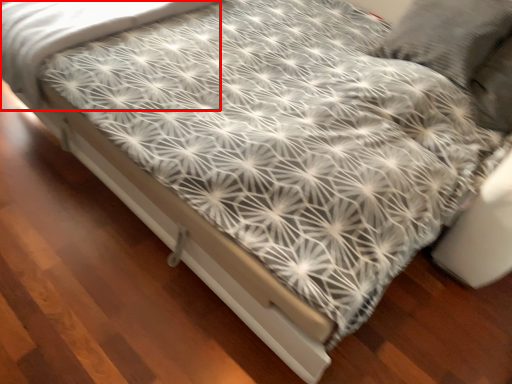
Question: From the image's perspective, where is sheet (annotated by the red box) located in relation to bed frame in the image?

Choices:
 (A) below
 (B) above

Answer: (B)